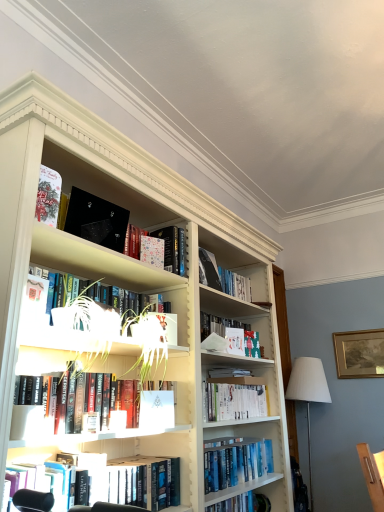
Question: Does green matte plant pot at upper left have a greater height compared to white fabric lampshade at right?

Choices:
 (A) yes
 (B) no

Answer: (B)

Question: From the image's perspective, is green matte plant pot at upper left above white fabric lampshade at right?

Choices:
 (A) no
 (B) yes

Answer: (B)

Question: Is green matte plant pot at upper left to the left of white fabric lampshade at right from the viewer's perspective?

Choices:
 (A) no
 (B) yes

Answer: (B)

Question: Is green matte plant pot at upper left positioned beyond the bounds of white fabric lampshade at right?

Choices:
 (A) no
 (B) yes

Answer: (B)

Question: Is green matte plant pot at upper left in front of white fabric lampshade at right?

Choices:
 (A) no
 (B) yes

Answer: (B)

Question: Is matte white book at center, placed as the first paperback book when sorted from right to left, inside the boundaries of green matte plant pot at upper left, or outside?

Choices:
 (A) outside
 (B) inside

Answer: (A)

Question: From a real-world perspective, relative to green matte plant pot at upper left, is matte white book at center, the first paperback book positioned from the back, vertically above or below?

Choices:
 (A) above
 (B) below

Answer: (B)

Question: Is matte white book at center, the third paperback book in the top-to-bottom sequence, taller or shorter than green matte plant pot at upper left?

Choices:
 (A) short
 (B) tall

Answer: (A)

Question: From the image's perspective, is matte white book at center, which ranks as the fourth paperback book in left-to-right order, located above or below green matte plant pot at upper left?

Choices:
 (A) above
 (B) below

Answer: (B)

Question: From the image's perspective, is hardcover books at center, the fourth book positioned from the bottom, above or below hardcover book at lower center, which is counted as the 6th book, starting from the top?

Choices:
 (A) below
 (B) above

Answer: (B)

Question: Would you say hardcover books at center, which is the 4th book from top to bottom, is to the left or to the right of hardcover book at lower center, which is counted as the 6th book, starting from the top, in the picture?

Choices:
 (A) left
 (B) right

Answer: (B)

Question: Considering the positions of point (152, 392) and point (114, 502), is point (152, 392) closer or farther from the camera than point (114, 502)?

Choices:
 (A) farther
 (B) closer

Answer: (A)

Question: Considering their positions, is hardcover books at center, the fourth book positioned from the bottom, located in front of or behind hardcover book at lower center, which is counted as the 6th book, starting from the top?

Choices:
 (A) front
 (B) behind

Answer: (B)

Question: Considering the relative positions of matte black book at upper left, which is the first paperback book in top-to-bottom order, and white fabric lampshade at right in the image provided, is matte black book at upper left, which is the first paperback book in top-to-bottom order, to the left or to the right of white fabric lampshade at right?

Choices:
 (A) left
 (B) right

Answer: (A)

Question: Does point (72, 186) appear closer or farther from the camera than point (309, 482)?

Choices:
 (A) farther
 (B) closer

Answer: (B)